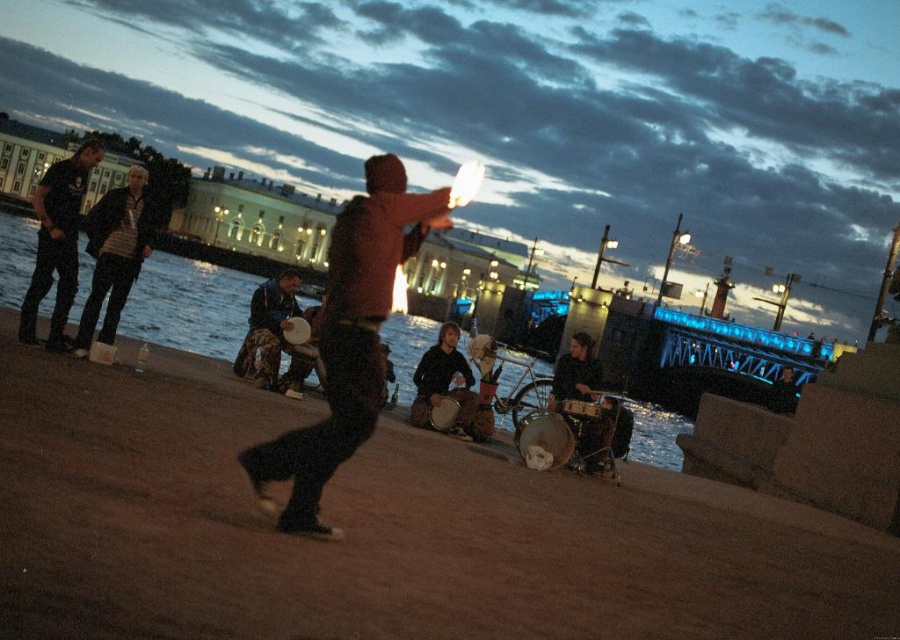
Does brown sand at center have a greater height compared to matte black jacket at left?

Incorrect, brown sand at center's height is not larger of matte black jacket at left's.

Which is in front, point (588, 531) or point (135, 172)?

Point (588, 531)

You are a GUI agent. You are given a task and a screenshot of the screen. Output one action in this format:
    pyautogui.click(x=<x>, y=<y>)
    Task: Click on the brown sand at center
    The height and width of the screenshot is (640, 900).
    Given the screenshot: What is the action you would take?
    pyautogui.click(x=381, y=531)

The width and height of the screenshot is (900, 640). What do you see at coordinates (189, 307) in the screenshot?
I see `blue water at lower center` at bounding box center [189, 307].

Is blue water at lower center positioned behind brown leather drum at center?

No, it is in front of brown leather drum at center.

Is point (212, 291) positioned behind point (414, 419)?

Yes, point (212, 291) is behind point (414, 419).

You are a GUI agent. You are given a task and a screenshot of the screen. Output one action in this format:
    pyautogui.click(x=<x>, y=<y>)
    Task: Click on the blue water at lower center
    This screenshot has width=900, height=640.
    Given the screenshot: What is the action you would take?
    pyautogui.click(x=189, y=307)

Where is `dark brown leather jacket at center`? This screenshot has width=900, height=640. dark brown leather jacket at center is located at coordinates (348, 339).

Who is positioned more to the left, dark brown leather jacket at center or brown leather drum at center?

dark brown leather jacket at center

I want to click on dark brown leather jacket at center, so click(348, 339).

Where is `dark brown leather jacket at center`? The height and width of the screenshot is (640, 900). dark brown leather jacket at center is located at coordinates (348, 339).